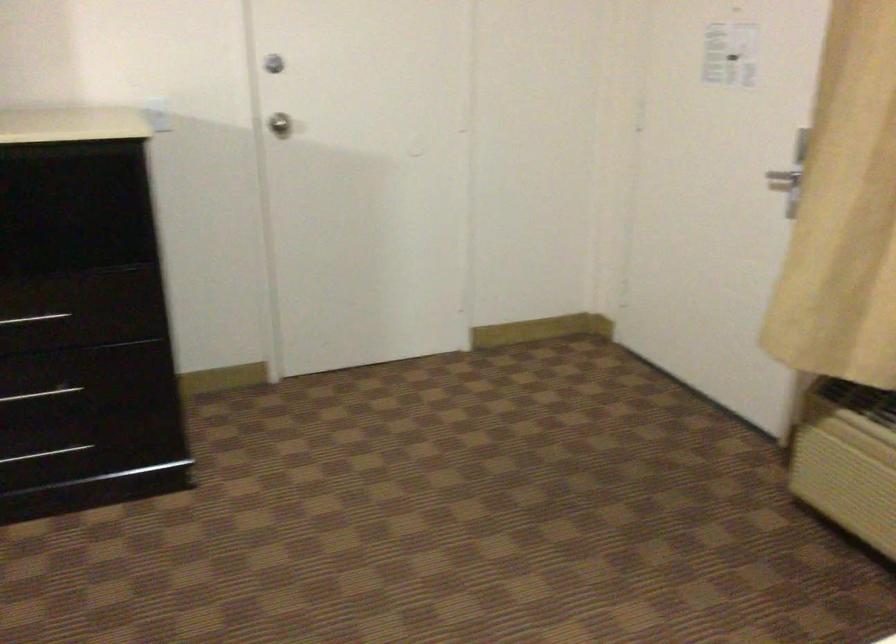
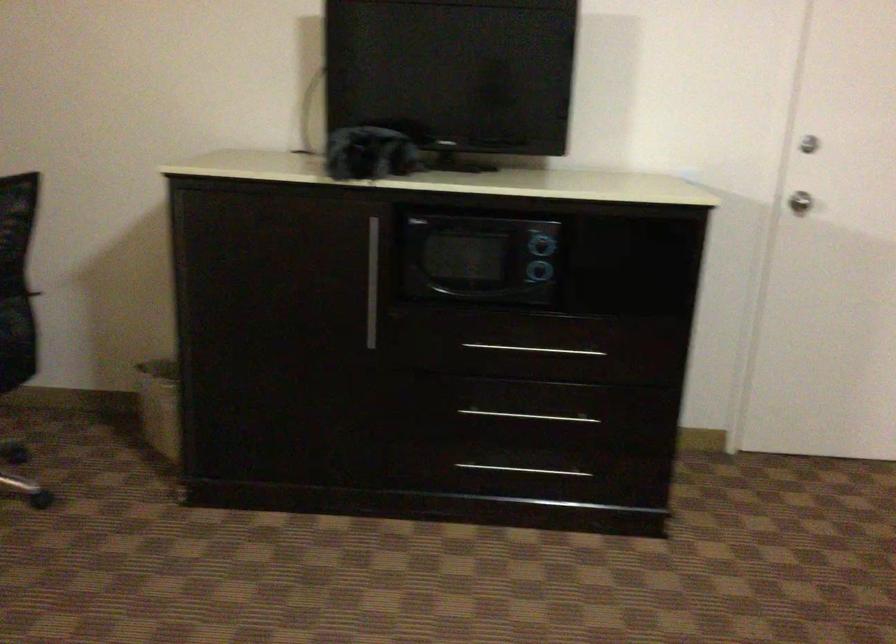
Question: What movement of the cameraman would produce the second image?

Choices:
 (A) Left
 (B) Right
 (C) Forward
 (D) Backward

Answer: (A)